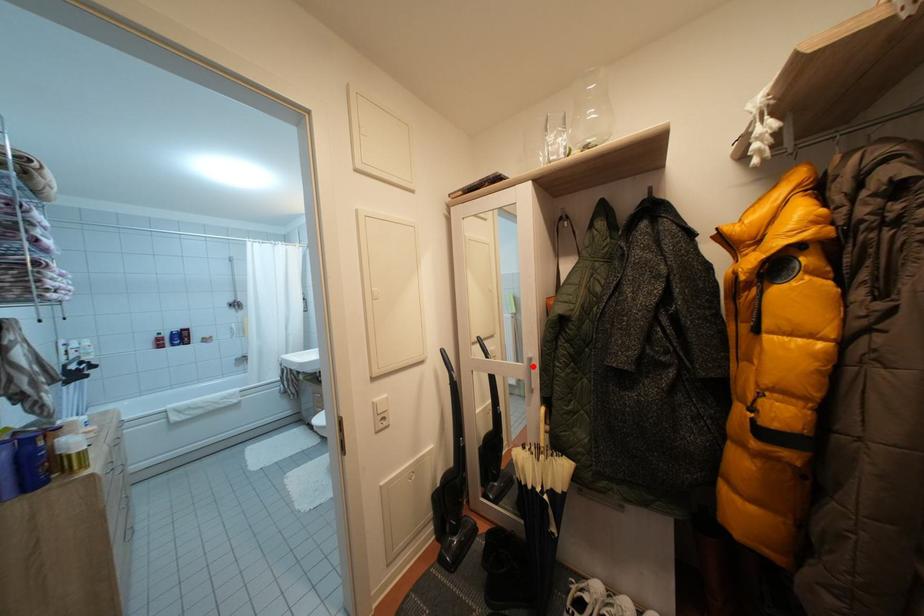
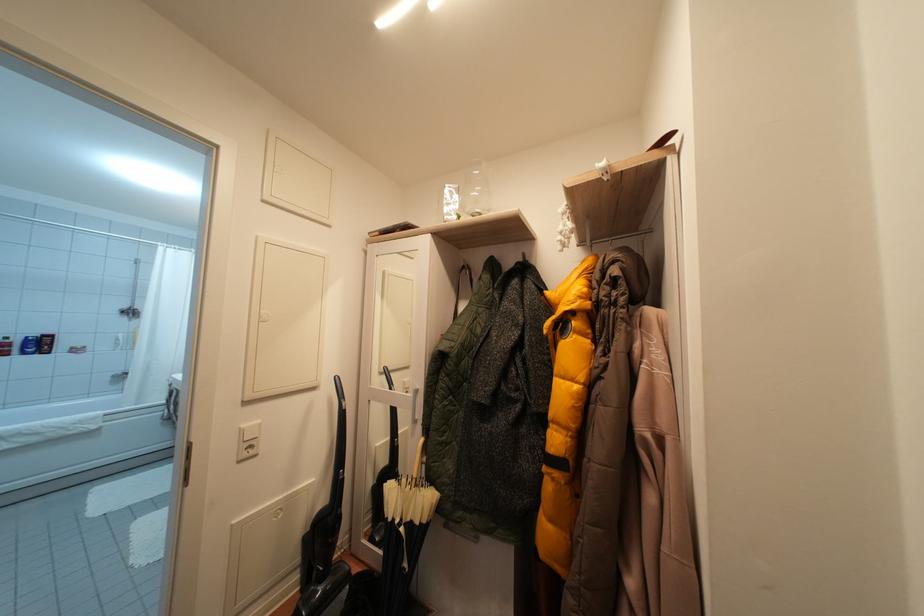
The point at the highlighted location is marked in the first image. Where is the corresponding point in the second image?

(419, 398)